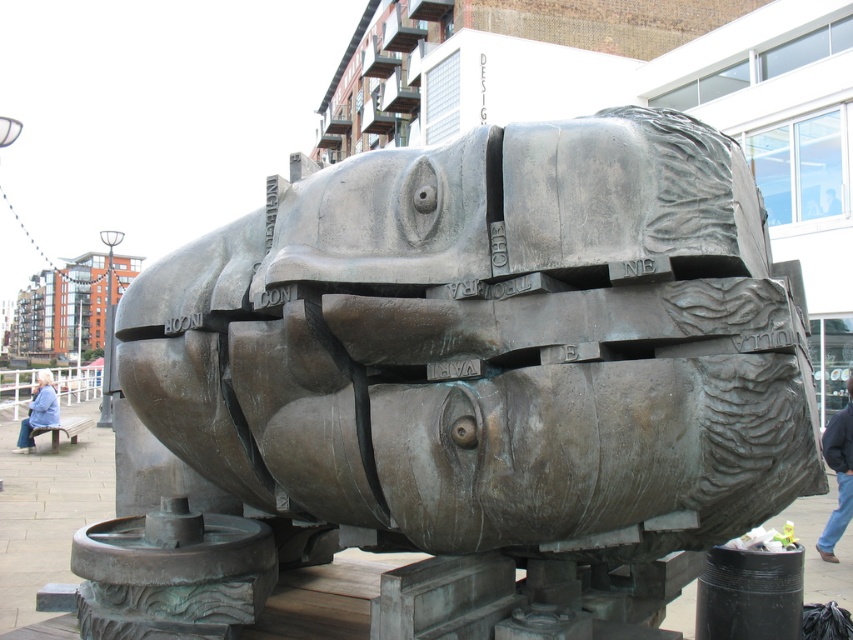
You are a photographer standing in front of the bronze fish at center and the blue denim jacket at lower left. You want to take a photo that includes both objects in the frame. Which object should you position closer to the left side of the camera to ensure both are visible?

The blue denim jacket at lower left should be positioned closer to the left side of the camera since the bronze fish at center is already to the right of it, allowing both to fit within the frame.

You are standing in front of the bronze fish at center. You need to reach a button located 12 feet away from the camera. Can you reach the button from your current position without moving?

The bronze fish at center is 10.62 feet from camera. Since the button is 12 feet away from the camera, you are closer to the button than the fish. Therefore, you can reach the button from your current position without moving.

You are an architect designing a new public space and want to place a new bench. The existing bronze fish at center is located at point (492, 365). If you want the bench to be exactly 1.2 meters away from the bronze fish at center, where should you place the bench?

The bench should be placed 1.2 meters away from the bronze fish at center at point (492, 365) in any direction as long as the distance is maintained.